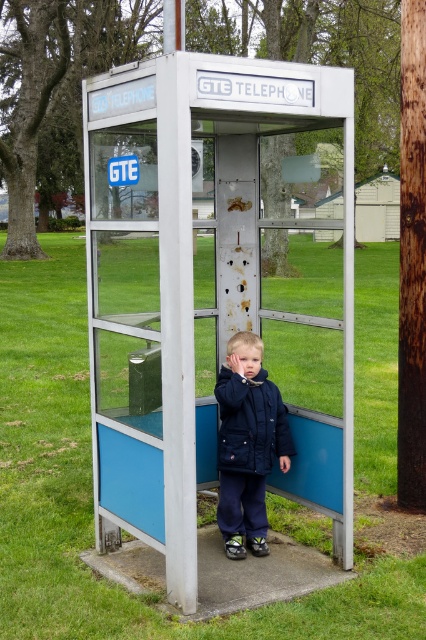
Is metallic blue telephone booth at center closer to the viewer compared to dark blue puffy coat at center?

Yes, metallic blue telephone booth at center is closer to the viewer.

Can you confirm if metallic blue telephone booth at center is smaller than dark blue puffy coat at center?

No, metallic blue telephone booth at center is not smaller than dark blue puffy coat at center.

Who is more forward, (158, 120) or (268, 388)?

Point (158, 120) is in front.

Locate an element on the screen. The image size is (426, 640). metallic blue telephone booth at center is located at coordinates [x=213, y=285].